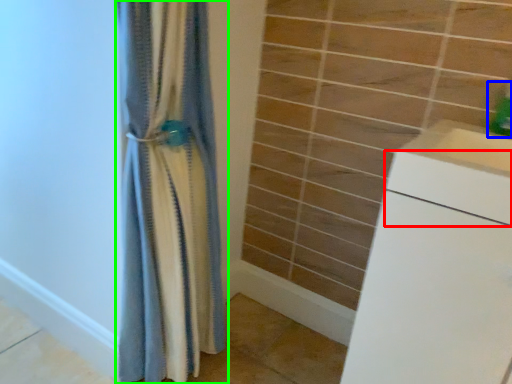
Question: Which is farther away from drawer (highlighted by a red box)? soap dispenser (highlighted by a blue box) or curtain (highlighted by a green box)?

Choices:
 (A) soap dispenser
 (B) curtain

Answer: (B)